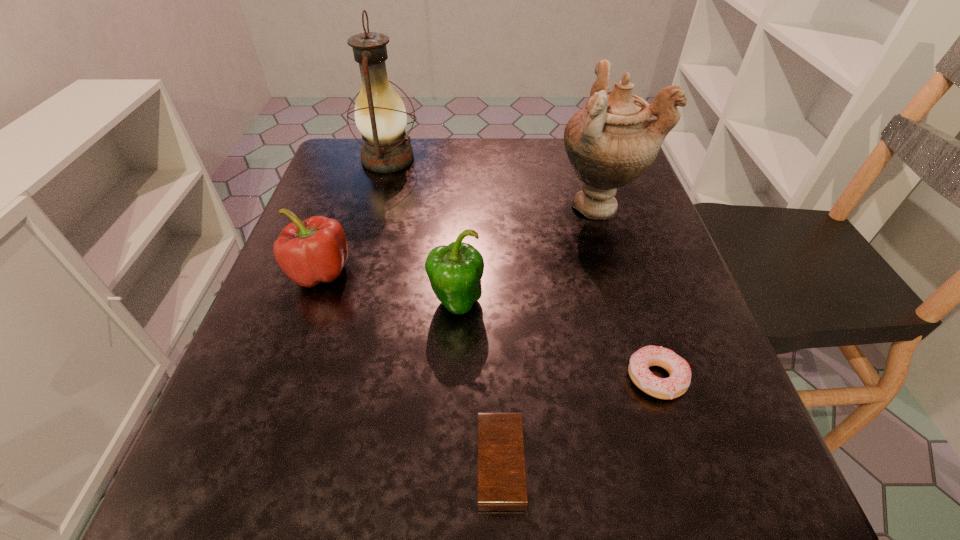
At what (x,y) coordinates should I click in order to perform the action: click on free space at the far right corner of the desktop. Please return your answer as a coordinate pair (x, y). This screenshot has width=960, height=540. Looking at the image, I should click on (621, 190).

This screenshot has width=960, height=540. I want to click on vacant space at the near right corner of the desktop, so click(779, 484).

Where is `empty location between the doughnut and the third shortest object`? empty location between the doughnut and the third shortest object is located at coordinates (489, 326).

Where is `vacant space that is in between the nearest object and the second tallest object`? vacant space that is in between the nearest object and the second tallest object is located at coordinates (550, 334).

Find the location of a particular element. The width and height of the screenshot is (960, 540). unoccupied area between the doughnut and the urn is located at coordinates (628, 292).

Locate an element on the screen. unoccupied position between the second tallest object and the second nearest object is located at coordinates (628, 292).

What are the coordinates of `free space between the shorter bell pepper and the nearest object` in the screenshot? It's located at (410, 368).

I want to click on free spot between the oil lamp and the left bell pepper, so click(x=354, y=215).

Identify the location of free space that is in between the fourth tallest object and the oil lamp. This screenshot has width=960, height=540. (354, 215).

You are a GUI agent. You are given a task and a screenshot of the screen. Output one action in this format:
    pyautogui.click(x=<x>, y=<y>)
    Task: Click on the vacant area that lies between the urn and the shortest object
    The width and height of the screenshot is (960, 540).
    Given the screenshot: What is the action you would take?
    pyautogui.click(x=550, y=334)